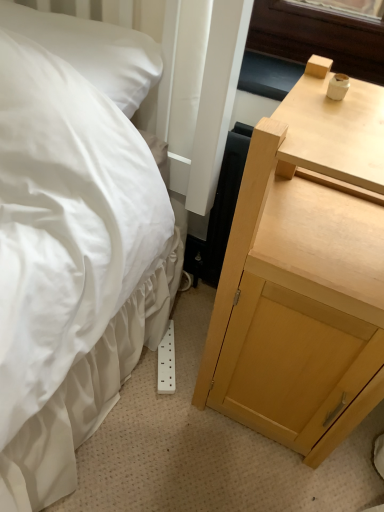
The height and width of the screenshot is (512, 384). Identify the location of free space to the left of light wood nightstand at right. (159, 410).